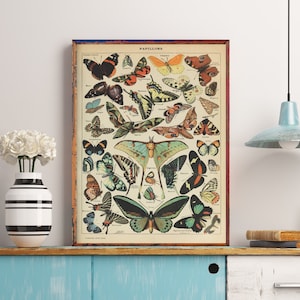
The image size is (300, 300). Find the location of `lightbulb`. lightbulb is located at coordinates (288, 143).